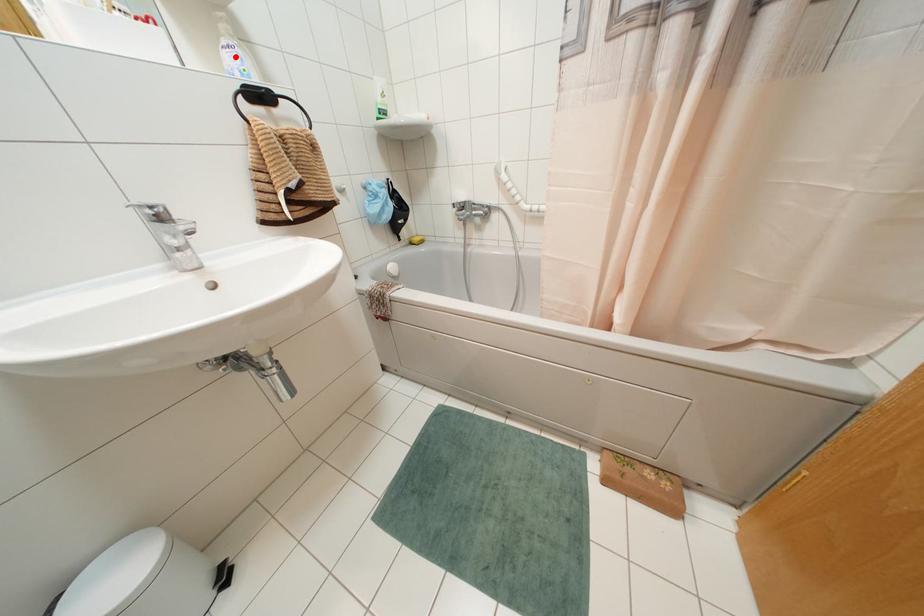
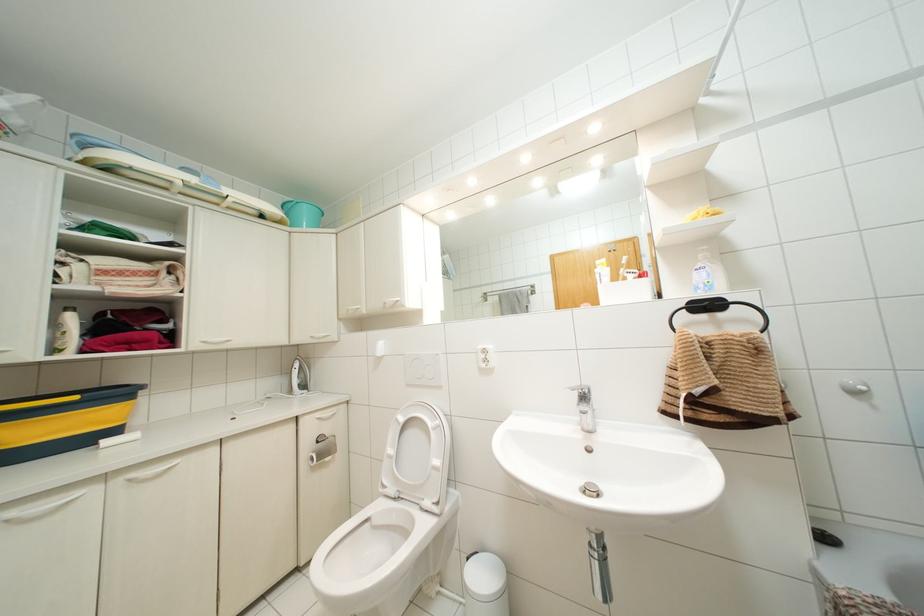
The point at the highlighted location is marked in the first image. Where is the corresponding point in the second image?

(703, 274)